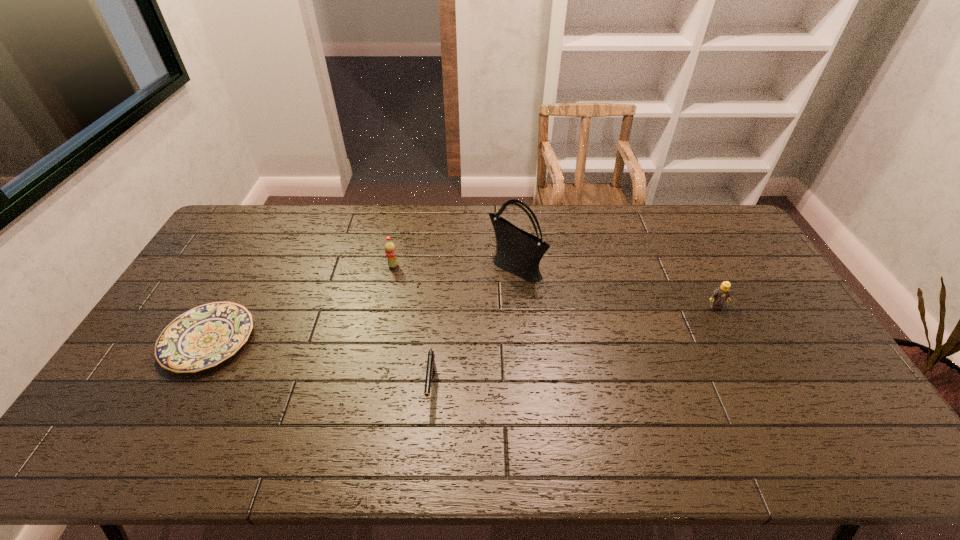
Identify the location of the tallest object. This screenshot has height=540, width=960. (518, 252).

Where is `shoulder bag`? The image size is (960, 540). shoulder bag is located at coordinates (518, 252).

Where is `the fourth object from right to left`? Image resolution: width=960 pixels, height=540 pixels. the fourth object from right to left is located at coordinates (390, 249).

Image resolution: width=960 pixels, height=540 pixels. I want to click on soda, so pos(390,249).

This screenshot has width=960, height=540. I want to click on the rightmost object, so click(x=721, y=294).

At what (x,y) coordinates should I click in order to perform the action: click on the third tallest object. Please return your answer as a coordinate pair (x, y). The height and width of the screenshot is (540, 960). Looking at the image, I should click on (721, 294).

Where is `the second shortest object`? the second shortest object is located at coordinates (431, 366).

Locate an element on the screen. pistol is located at coordinates (431, 366).

This screenshot has height=540, width=960. Find the location of `the shortest object`. the shortest object is located at coordinates (203, 337).

Identify the location of plate. (203, 337).